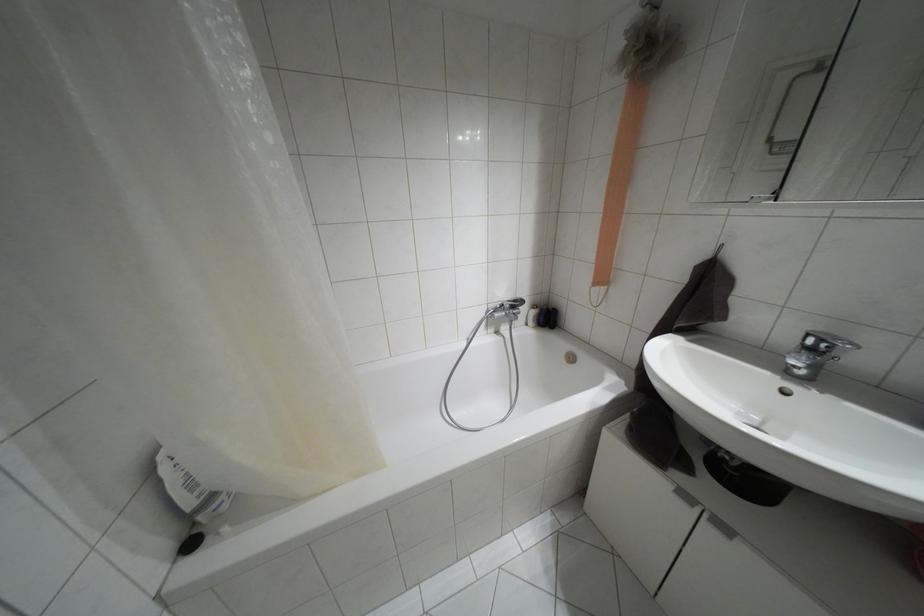
Find the location of a particular element. This screenshot has width=924, height=616. bathtub diverter knob is located at coordinates (513, 302).